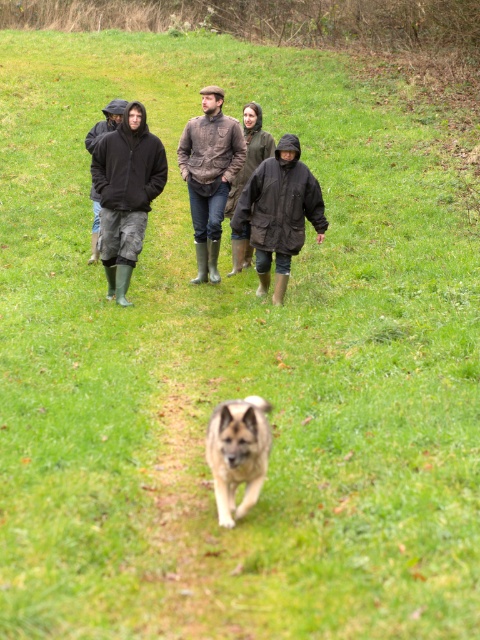
You are a photographer standing on the path and want to take a photo of the two people wearing matte black jackets. The person in the matte black jacket at left is blocking your view of the person in the matte black jacket at center. How can you adjust your position to see both individuals clearly?

Since the matte black jacket at left is positioned over the matte black jacket at center, you should move to the right side of the path so that the person in the matte black jacket at left moves out of the way, allowing you to see both individuals clearly.

You are a photographer standing at the end of the path. You want to take a photo that includes both the matte black jacket at left and the matte black jacket at center. Which jacket should you focus on first if you want to ensure both are in frame?

The matte black jacket at left is taller than the matte black jacket at center. Therefore, you should focus on the matte black jacket at left first to ensure both are in frame since it is taller and might be more visible.